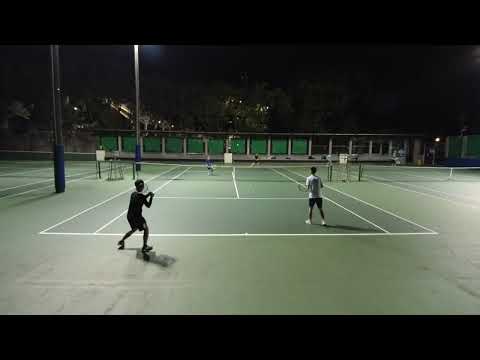
The width and height of the screenshot is (480, 360). Identify the location of table. (113, 164).